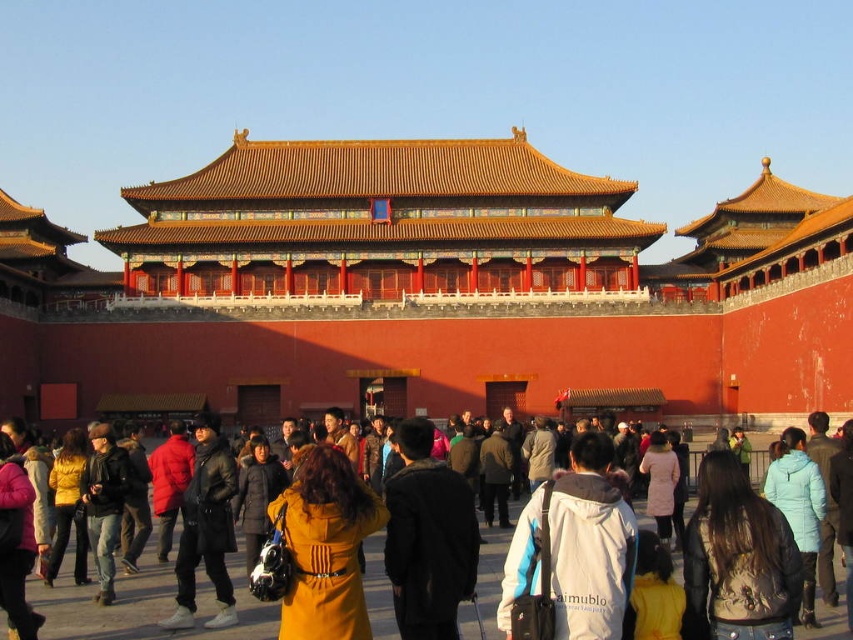
You are a tour guide at this historical site and notice two visitors wearing coats. One has a brown leather jacket at lower right and another has a light blue fabric coat at lower right. Which coat is closer to the ground?

The brown leather jacket at lower right is closer to the ground because it is positioned under the light blue fabric coat at lower right.

From the picture: You are a tour guide leading a group through this historical site and notice two visitors wearing a dark brown leather jacket at center and a matte yellow coat at center. Which visitor might you approach first if you need to give a safety briefing that requires immediate attention?

The dark brown leather jacket at center has a larger size compared to the matte yellow coat at center, so the visitor wearing the dark brown leather jacket at center might be easier to spot and approach quickly for the safety briefing.

You are standing in front of the central red wall with a golden roof in the historical complex. There are two points marked on the wall. One is at coordinates point (479, 604) and the other at point (358, 579). Which point is closer to you?

Point (479, 604) is closer to you because it is further to the viewer than point (358, 579).